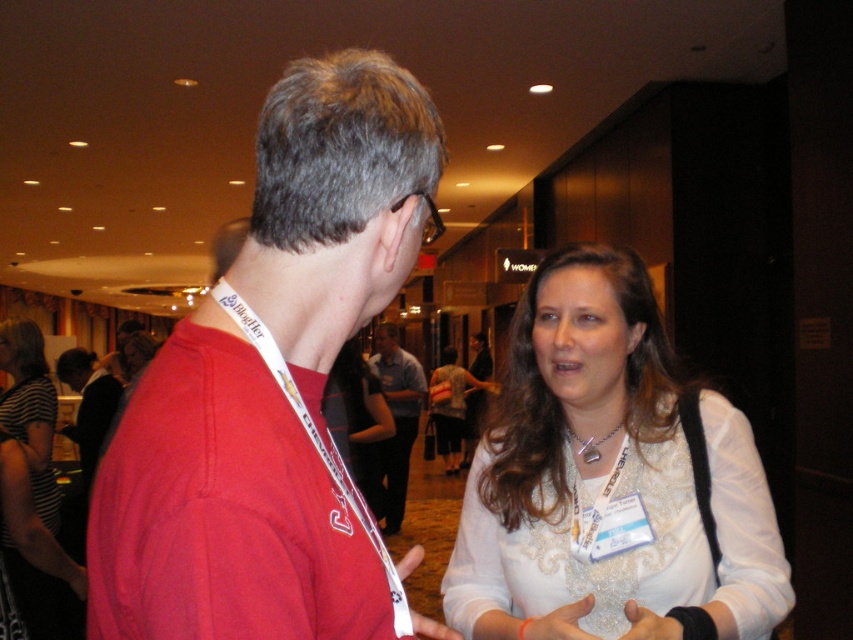
Is matte blue shirt at center to the left of red cotton shirt at center from the viewer's perspective?

Correct, you'll find matte blue shirt at center to the left of red cotton shirt at center.

Does point (412, 392) lie behind point (479, 406)?

No, (412, 392) is closer to viewer.

Is point (386, 362) less distant than point (469, 451)?

Yes, it is.

Identify the location of matte blue shirt at center. (396, 419).

Is point (112, 403) less distant than point (471, 424)?

Yes, it is in front of point (471, 424).

Which is behind, point (100, 397) or point (474, 426)?

The point (474, 426) is behind.

Where is `red cotton t-shirt at center`? This screenshot has width=853, height=640. red cotton t-shirt at center is located at coordinates (88, 404).

Is matte blue shirt at center further to camera compared to silver metallic necklace at center?

Yes, matte blue shirt at center is further from the viewer.

Which of these two, matte blue shirt at center or silver metallic necklace at center, stands taller?

Standing taller between the two is matte blue shirt at center.

Which is behind, point (395, 330) or point (592, 458)?

Positioned behind is point (395, 330).

At what (x,y) coordinates should I click in order to perform the action: click on matte blue shirt at center. Please return your answer as a coordinate pair (x, y). The width and height of the screenshot is (853, 640). Looking at the image, I should click on click(396, 419).